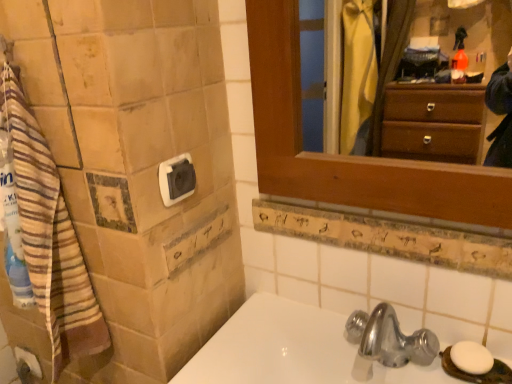
Where is `free location to the left of white matte soap at lower right`? Image resolution: width=512 pixels, height=384 pixels. free location to the left of white matte soap at lower right is located at coordinates (385, 355).